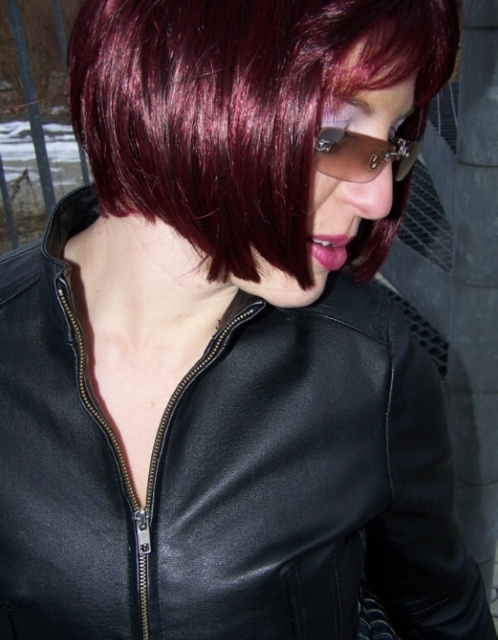
Consider the image. Who is higher up, shiny burgundy hair at center or sunglasses at center?

shiny burgundy hair at center

Who is positioned more to the right, shiny burgundy hair at center or sunglasses at center?

sunglasses at center is more to the right.

What are the coordinates of `shiny burgundy hair at center` in the screenshot? It's located at (238, 108).